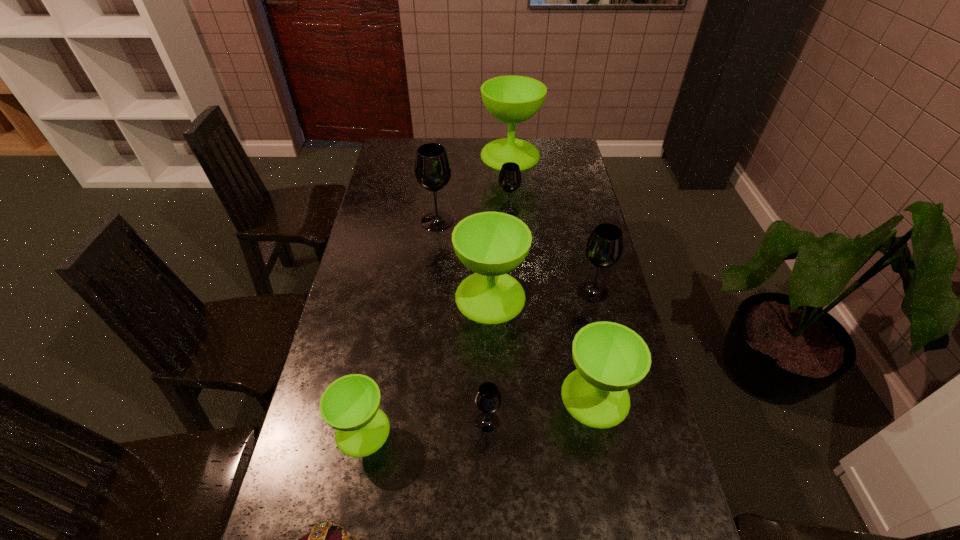
You are a GUI agent. You are given a task and a screenshot of the screen. Output one action in this format:
    pyautogui.click(x=<x>, y=<y>)
    Task: Click on the farthest wineglass
    The height and width of the screenshot is (540, 960).
    Given the screenshot: What is the action you would take?
    pyautogui.click(x=512, y=99)

The width and height of the screenshot is (960, 540). I want to click on the farthest object, so click(512, 99).

Identify the location of the leftmost gray wineglass. The image size is (960, 540). (432, 168).

Identify the location of the biggest gray wineglass. The height and width of the screenshot is (540, 960). (432, 168).

Identify the location of the rightmost gray wineglass. (604, 247).

Find the location of a particular element. This screenshot has width=960, height=540. the second biggest gray wineglass is located at coordinates (604, 247).

Where is `the second farthest green wineglass`? This screenshot has height=540, width=960. the second farthest green wineglass is located at coordinates (491, 244).

The width and height of the screenshot is (960, 540). In order to click on the second gray wineglass from right to left in this screenshot , I will do `click(509, 179)`.

The width and height of the screenshot is (960, 540). I want to click on the third biggest green wineglass, so click(x=610, y=358).

Find the location of a particular element. The width and height of the screenshot is (960, 540). the leftmost green wineglass is located at coordinates (350, 404).